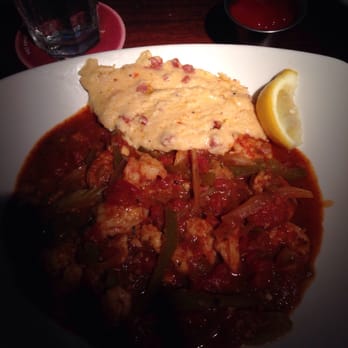
Where is `bottom of glass`? This screenshot has width=348, height=348. bottom of glass is located at coordinates (62, 28).